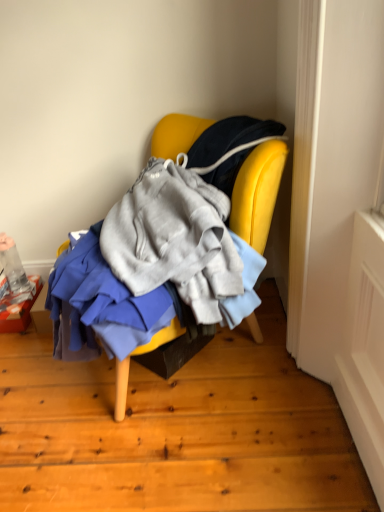
Question: Should I look upward or downward to see yellow fabric chair at center?

Choices:
 (A) up
 (B) down

Answer: (A)

Question: Is yellow fabric chair at center to the left of orange cardboard box at lower left from the viewer's perspective?

Choices:
 (A) no
 (B) yes

Answer: (A)

Question: From the image's perspective, would you say yellow fabric chair at center is shown under orange cardboard box at lower left?

Choices:
 (A) no
 (B) yes

Answer: (A)

Question: Is yellow fabric chair at center in front of orange cardboard box at lower left?

Choices:
 (A) no
 (B) yes

Answer: (B)

Question: Are yellow fabric chair at center and orange cardboard box at lower left making contact?

Choices:
 (A) no
 (B) yes

Answer: (A)

Question: Is yellow fabric chair at center behind orange cardboard box at lower left?

Choices:
 (A) no
 (B) yes

Answer: (A)

Question: Is yellow fabric chair at center thinner than orange cardboard box at lower left?

Choices:
 (A) no
 (B) yes

Answer: (A)

Question: From a real-world perspective, does orange cardboard box at lower left sit lower than yellow fabric chair at center?

Choices:
 (A) no
 (B) yes

Answer: (B)

Question: Is orange cardboard box at lower left to the left of yellow fabric chair at center from the viewer's perspective?

Choices:
 (A) no
 (B) yes

Answer: (B)

Question: Can you confirm if orange cardboard box at lower left is thinner than yellow fabric chair at center?

Choices:
 (A) yes
 (B) no

Answer: (A)

Question: Would you say orange cardboard box at lower left is a long distance from yellow fabric chair at center?

Choices:
 (A) yes
 (B) no

Answer: (B)

Question: Does orange cardboard box at lower left have a smaller size compared to yellow fabric chair at center?

Choices:
 (A) yes
 (B) no

Answer: (A)

Question: Does orange cardboard box at lower left have a lesser height compared to yellow fabric chair at center?

Choices:
 (A) no
 (B) yes

Answer: (B)

Question: Is orange cardboard box at lower left bigger or smaller than yellow fabric chair at center?

Choices:
 (A) small
 (B) big

Answer: (A)